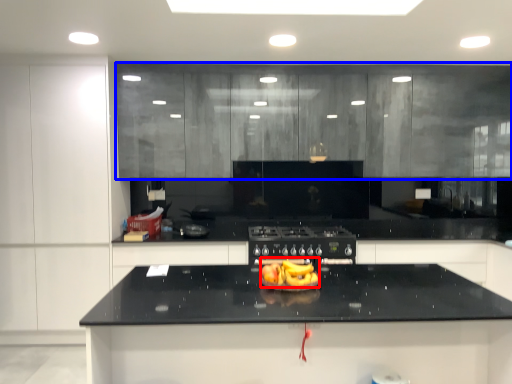
Question: Which object is closer to the camera taking this photo, food (highlighted by a red box) or cabinetry (highlighted by a blue box)?

Choices:
 (A) food
 (B) cabinetry

Answer: (A)